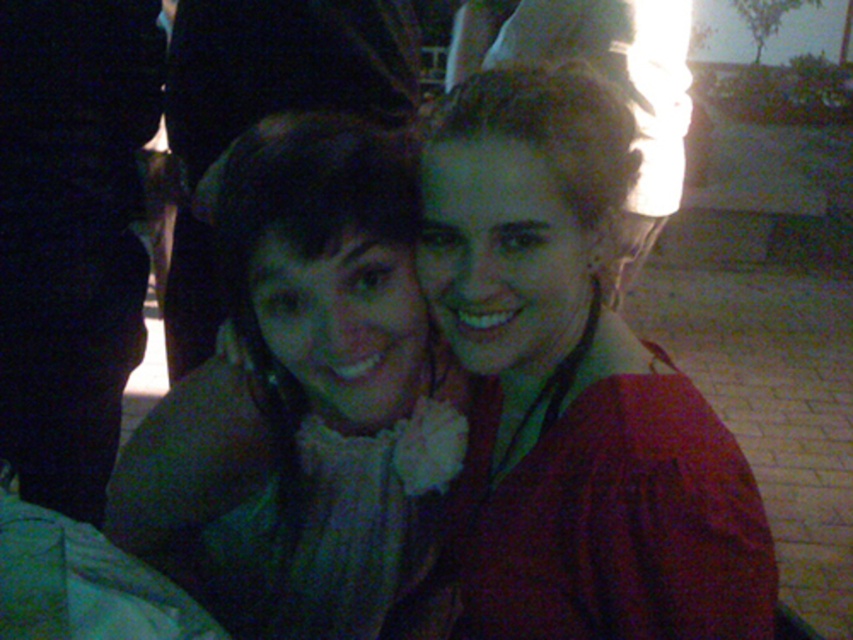
You are a photographer trying to adjust the lighting for a portrait. You notice the matte red sweater at center and the green fabric scarf at center in the frame. Considering the current distance between them, can you estimate if the lighting setup you have, which is designed for objects up to 6 inches apart, will suffice for even illumination?

The matte red sweater at center and green fabric scarf at center are 6.68 inches apart from each other. Since the lighting setup is designed for objects up to 6 inches apart, the current distance exceeds the recommended range. Therefore, the lighting setup may not provide even illumination for both the matte red sweater at center and green fabric scarf at center.

You are a photographer trying to adjust the lighting for a portrait. You notice the matte red sweater at center and the green fabric scarf at center in the scene. Which item should you focus on if you want to highlight the thinner object?

The matte red sweater at center is thinner than the green fabric scarf at center, so you should focus on the matte red sweater at center to highlight the thinner object.